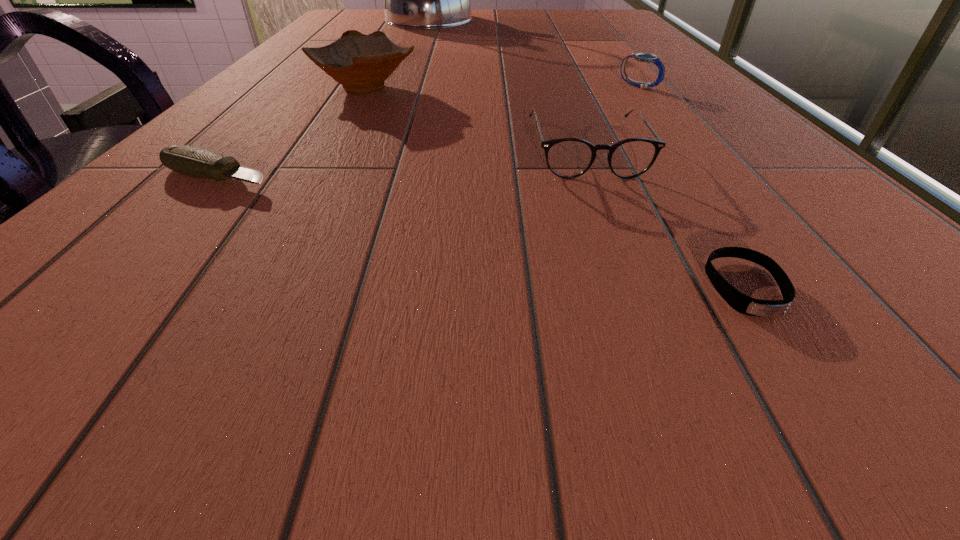
What are the coordinates of `vacant space situated on the back of the watch` in the screenshot? It's located at (618, 60).

Where is `vacant space located through the lenses of the spectacles`? vacant space located through the lenses of the spectacles is located at coordinates (617, 226).

The width and height of the screenshot is (960, 540). I want to click on blank space located on the front of the second shortest object, so click(126, 278).

Where is `vacant position located 0.090m on the display of the shortest object`? The width and height of the screenshot is (960, 540). vacant position located 0.090m on the display of the shortest object is located at coordinates (826, 407).

Identify the location of object that is at the far edge. (413, 0).

The height and width of the screenshot is (540, 960). What are the coordinates of `kettle at the left edge` in the screenshot? It's located at (413, 0).

This screenshot has height=540, width=960. Identify the location of pottery positioned at the left edge. (361, 63).

You are a GUI agent. You are given a task and a screenshot of the screen. Output one action in this format:
    pyautogui.click(x=<x>, y=<y>)
    Task: Click on the pocketknife that is positioned at the left edge
    This screenshot has height=540, width=960.
    Given the screenshot: What is the action you would take?
    pyautogui.click(x=193, y=161)

The height and width of the screenshot is (540, 960). Identify the location of watch situated at the right edge. (642, 57).

The width and height of the screenshot is (960, 540). Identify the location of wristband at the right edge. (740, 302).